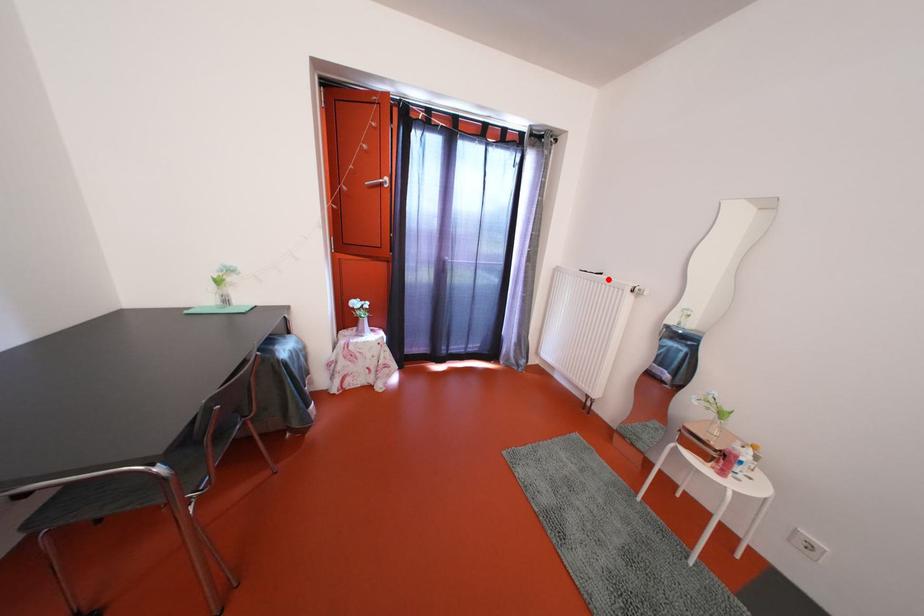
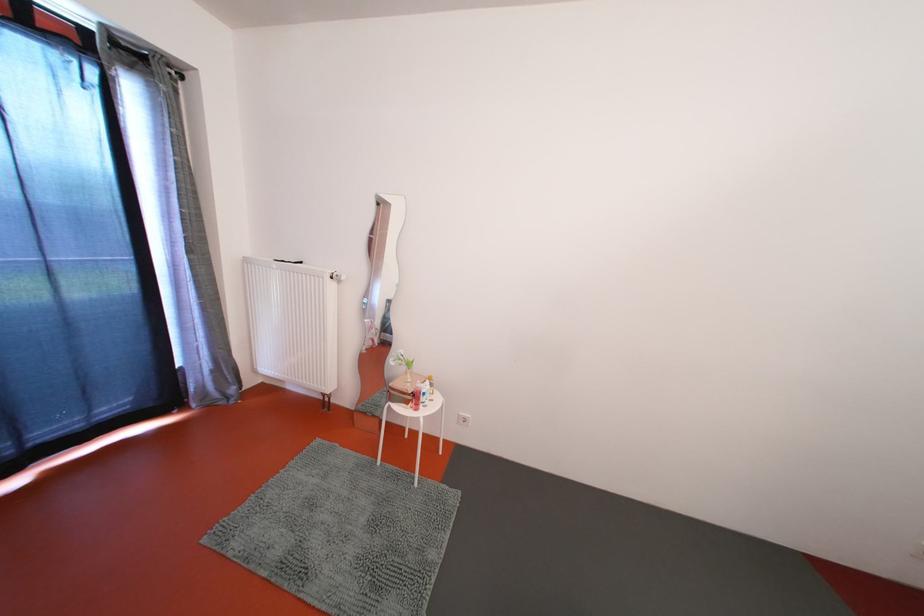
In the second image, find the point that corresponds to the highlighted location in the first image.

(309, 268)